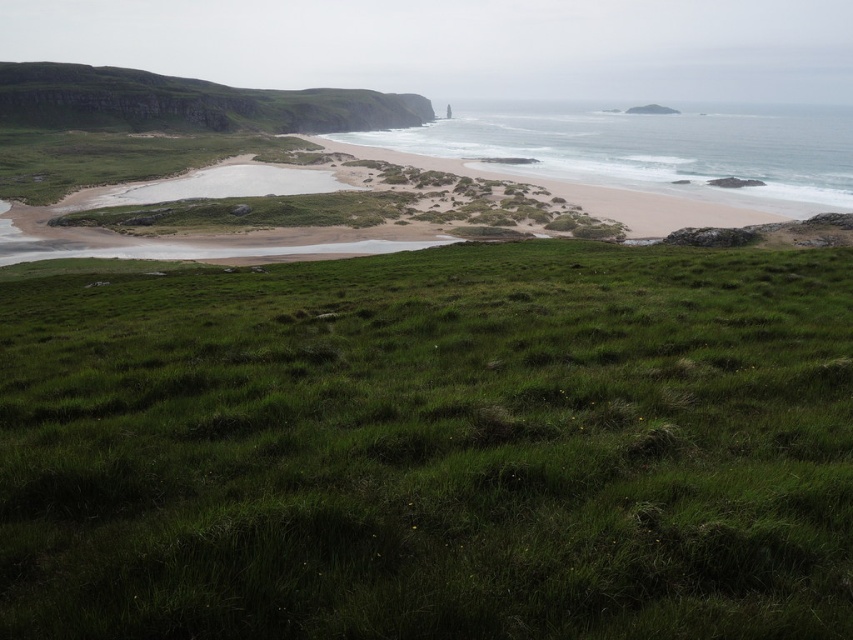
Question: Which point is closer to the camera?

Choices:
 (A) (154, 88)
 (B) (439, 124)

Answer: (A)

Question: Which point is farther to the camera?

Choices:
 (A) (508, 125)
 (B) (827, 628)

Answer: (A)

Question: Is green grassy field at lower center to the right of white sandy beach at center from the viewer's perspective?

Choices:
 (A) no
 (B) yes

Answer: (A)

Question: Is green grassy field at lower center further to camera compared to white sandy beach at center?

Choices:
 (A) yes
 (B) no

Answer: (B)

Question: Estimate the real-world distances between objects in this image. Which object is farther from the green grassy hillside at upper left?

Choices:
 (A) green grassy field at lower center
 (B) white sandy beach at center

Answer: (A)

Question: Is green grassy field at lower center thinner than white sandy beach at center?

Choices:
 (A) no
 (B) yes

Answer: (B)